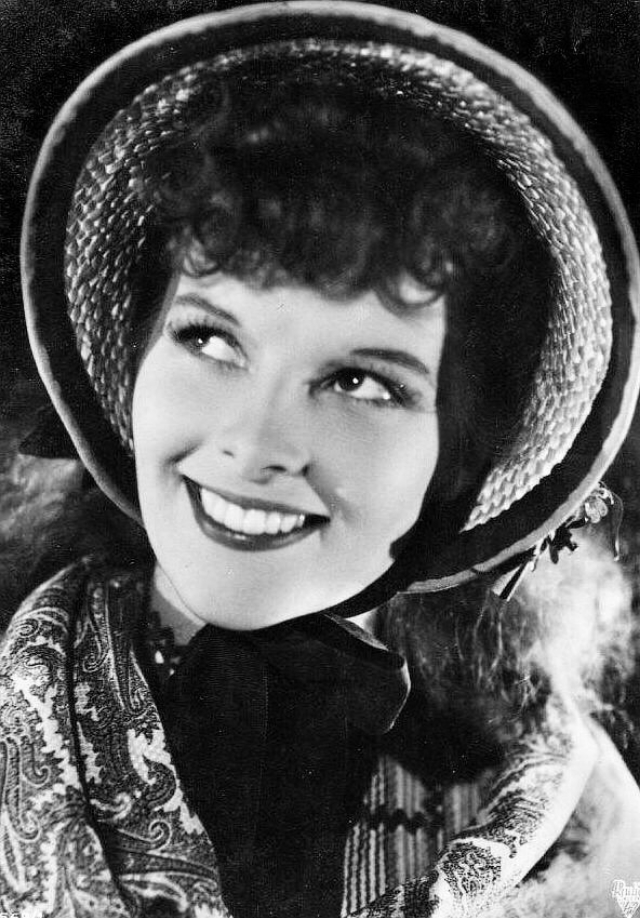
Identify the location of coat. (120, 778).